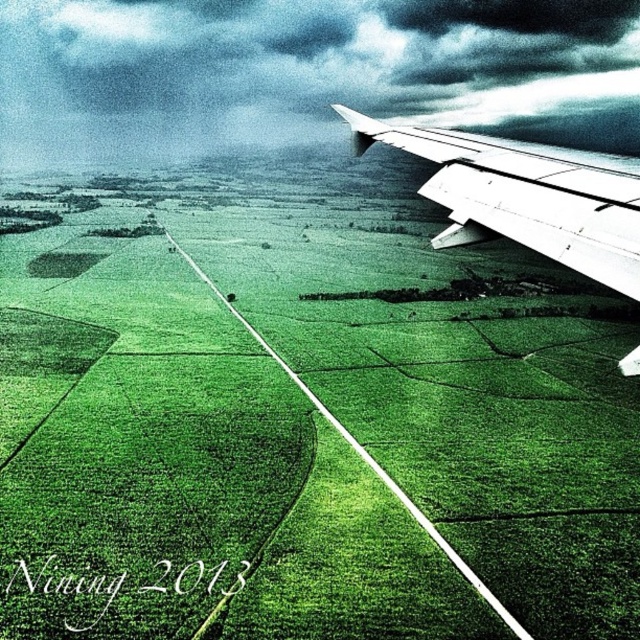
You are a pilot looking at the view from the airplane window. You need to identify the location of the green grassy field at upper center. Which coordinate point would you look at?

The green grassy field at upper center is located at coordinate point [305,420].

You are a pilot flying an airplane and looking out the window. You notice the green grassy field at upper center and the dark gray textured cloud at upper center. Which object is closer to you based on their positions?

The green grassy field at upper center is closer to you because it is taller than the dark gray textured cloud at upper center, indicating it is in front of the cloud.